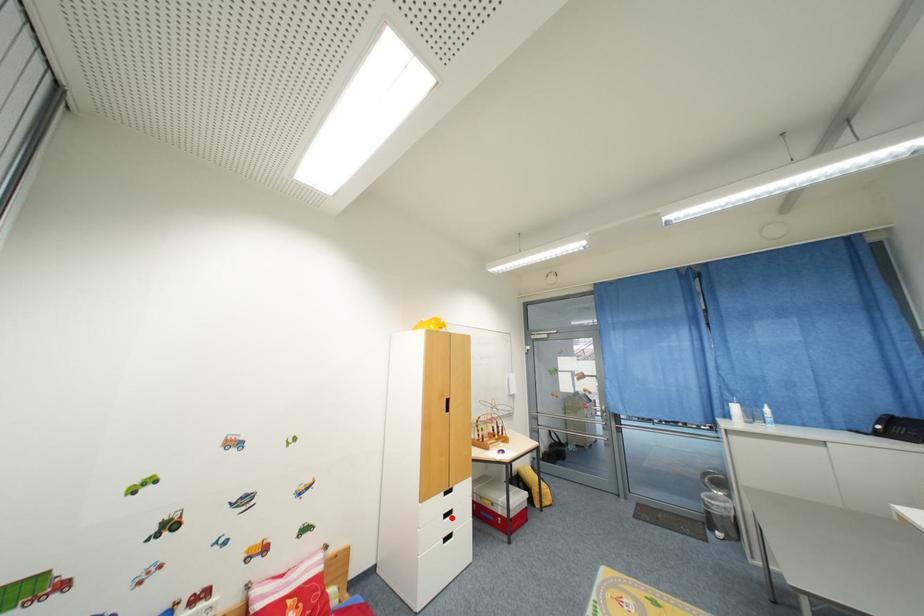
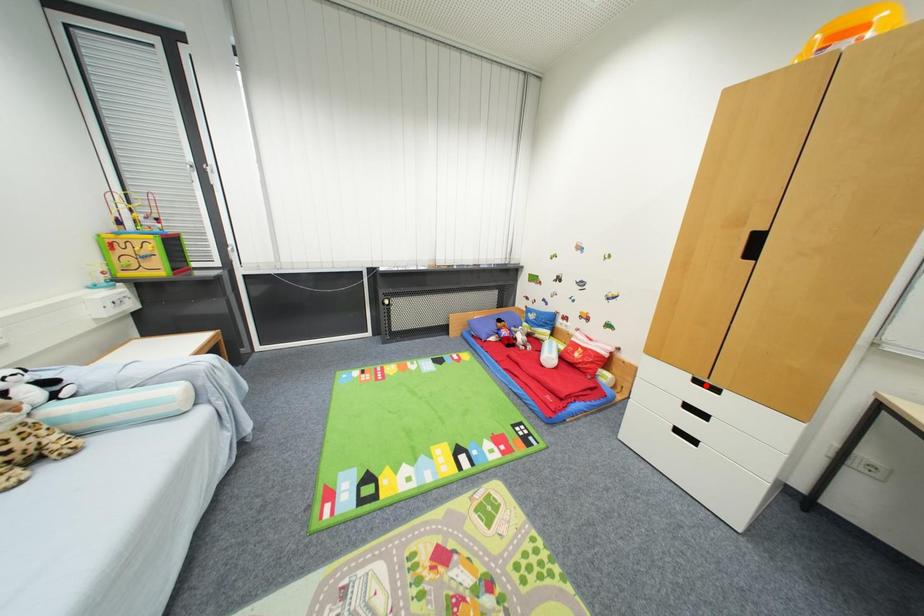
I am providing you with two images of the same scene from different viewpoints. A red point is marked on the first image and another point is marked on the second image. Are the points marked in image1 and image2 representing the same 3D position?

No